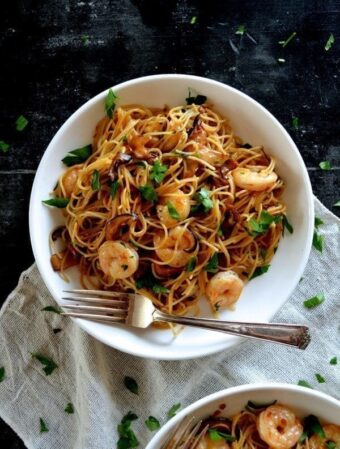
Identify the location of place to hold fork. (272, 330).